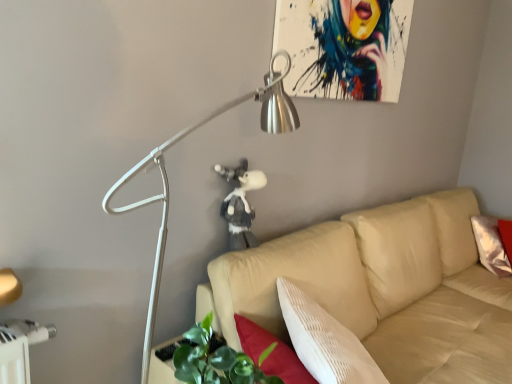
Where is `free spot to the right of fluffy gray plush at center`? The height and width of the screenshot is (384, 512). free spot to the right of fluffy gray plush at center is located at coordinates (283, 249).